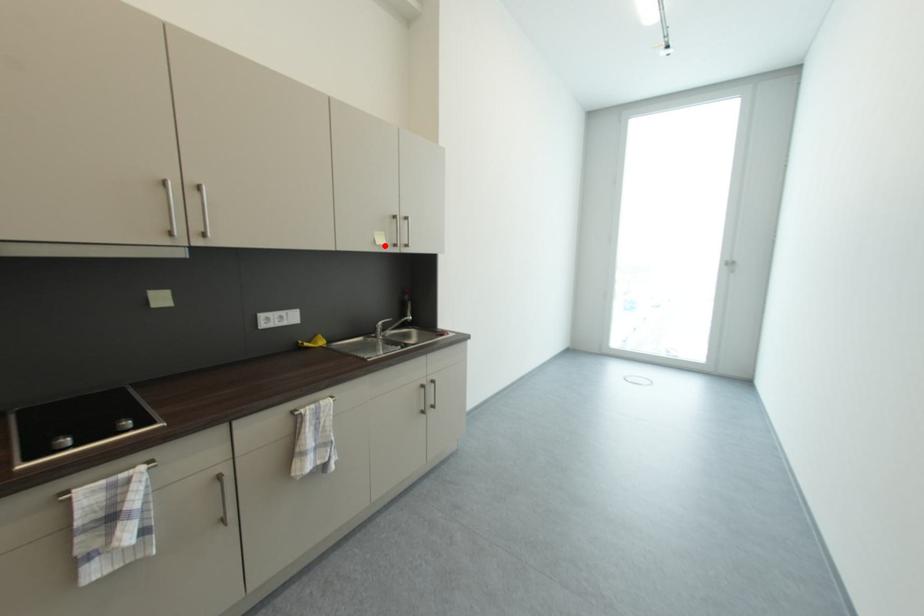
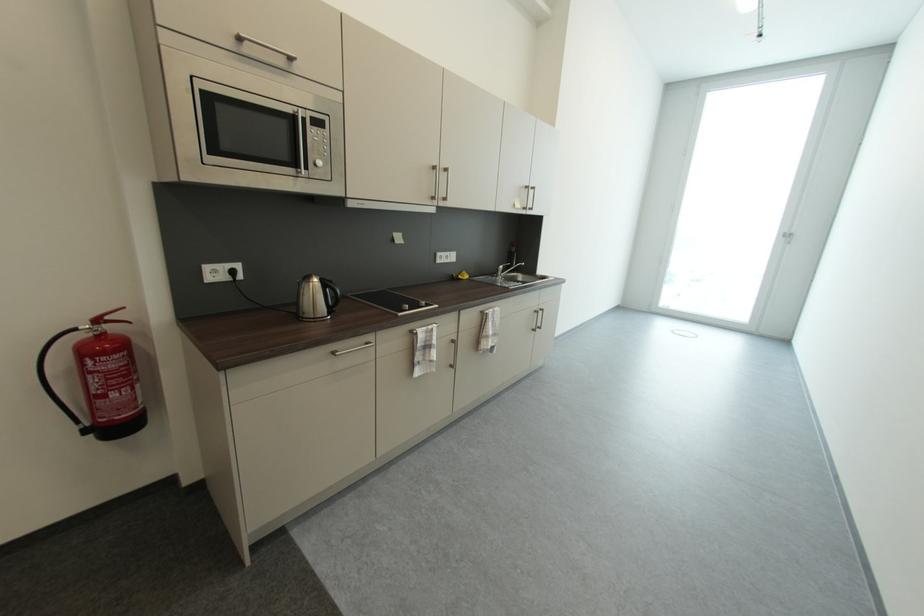
Where in the second image is the point corresponding to the highlighted location from the first image?

(523, 209)